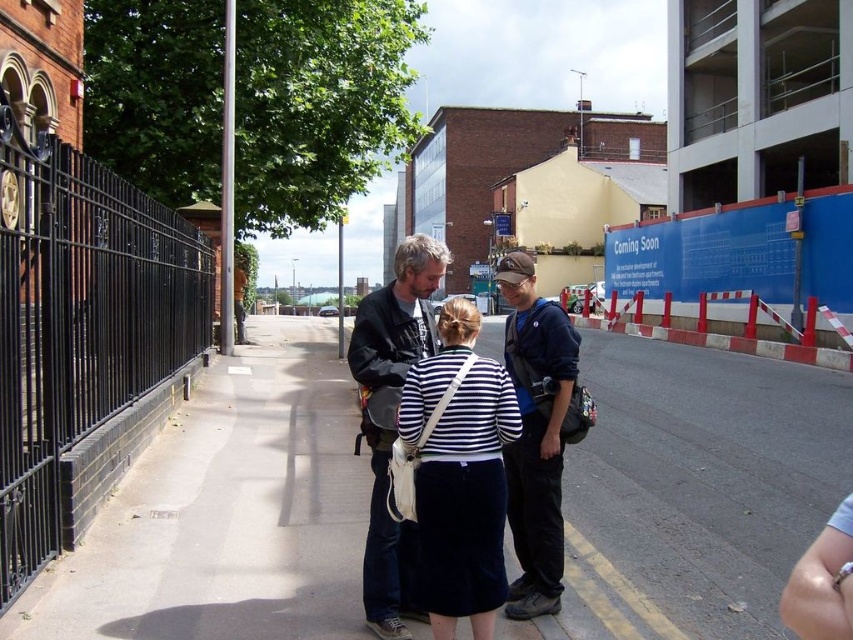
Which is behind, point (57, 280) or point (426, 413)?

Positioned behind is point (57, 280).

Who is taller, black wrought iron fence at left or white striped shirt at center?

Standing taller between the two is white striped shirt at center.

Which is in front, point (161, 259) or point (432, 364)?

Positioned in front is point (432, 364).

This screenshot has height=640, width=853. Identify the location of black wrought iron fence at left. (79, 324).

Can you confirm if concrete sidewalk at center is taller than white striped shirt at center?

Incorrect, concrete sidewalk at center's height is not larger of white striped shirt at center's.

In the scene shown: Does concrete sidewalk at center appear over white striped shirt at center?

Actually, concrete sidewalk at center is below white striped shirt at center.

The width and height of the screenshot is (853, 640). Describe the element at coordinates (693, 492) in the screenshot. I see `concrete sidewalk at center` at that location.

This screenshot has height=640, width=853. Identify the location of concrete sidewalk at center. (693, 492).

Is black wrought iron fence at left to the left of red plastic barricade at right from the viewer's perspective?

Indeed, black wrought iron fence at left is positioned on the left side of red plastic barricade at right.

Is point (38, 554) in front of point (670, 321)?

That is True.

Which is behind, point (82, 208) or point (598, 320)?

The point (598, 320) is behind.

The width and height of the screenshot is (853, 640). What are the coordinates of `black wrought iron fence at left` in the screenshot? It's located at (79, 324).